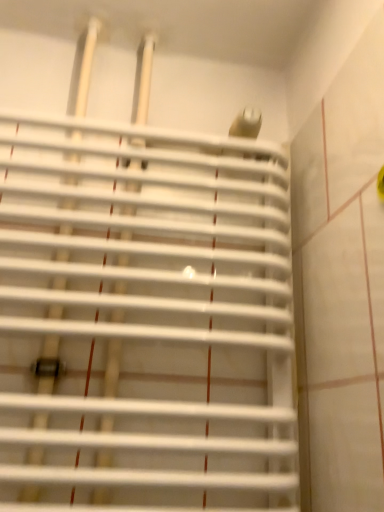
The width and height of the screenshot is (384, 512). What do you see at coordinates (143, 318) in the screenshot?
I see `white plastic window blind at center` at bounding box center [143, 318].

This screenshot has height=512, width=384. Find the location of `white plastic window blind at center`. white plastic window blind at center is located at coordinates (143, 318).

Identify the location of white plastic window blind at center. This screenshot has height=512, width=384. (143, 318).